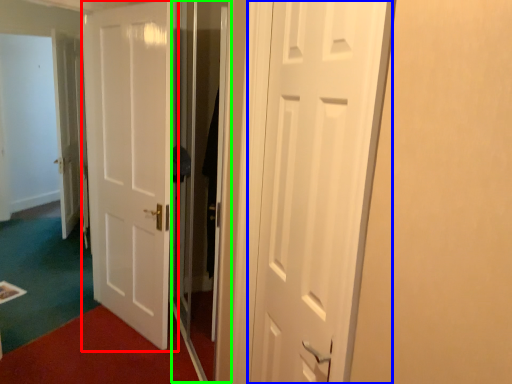
Question: Based on their relative distances, which object is nearer to door (highlighted by a red box)? Choose from door (highlighted by a blue box) and screen door (highlighted by a green box).

Choices:
 (A) door
 (B) screen door

Answer: (B)